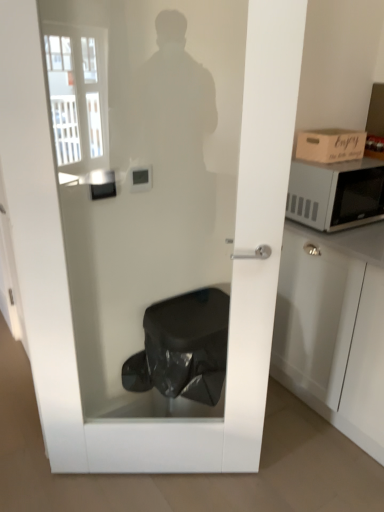
Question: Is satin silver microwave at right to the left or to the right of wooden cardboard box at upper right in the image?

Choices:
 (A) left
 (B) right

Answer: (B)

Question: Looking at their shapes, would you say satin silver microwave at right is wider or thinner than wooden cardboard box at upper right?

Choices:
 (A) wide
 (B) thin

Answer: (A)

Question: From a real-world perspective, is satin silver microwave at right positioned above or below wooden cardboard box at upper right?

Choices:
 (A) above
 (B) below

Answer: (B)

Question: Considering their positions, is wooden cardboard box at upper right located in front of or behind satin silver microwave at right?

Choices:
 (A) behind
 (B) front

Answer: (A)

Question: Does point (x=322, y=148) appear closer or farther from the camera than point (x=347, y=204)?

Choices:
 (A) farther
 (B) closer

Answer: (B)

Question: Is wooden cardboard box at upper right to the left or to the right of satin silver microwave at right in the image?

Choices:
 (A) left
 (B) right

Answer: (A)

Question: In terms of width, does wooden cardboard box at upper right look wider or thinner when compared to satin silver microwave at right?

Choices:
 (A) wide
 (B) thin

Answer: (B)